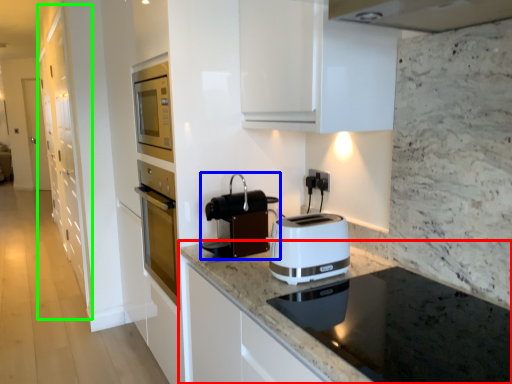
Question: Which object is positioned closest to countertop (highlighted by a red box)? Select from kitchen appliance (highlighted by a blue box) and cabinetry (highlighted by a green box).

Choices:
 (A) kitchen appliance
 (B) cabinetry

Answer: (A)